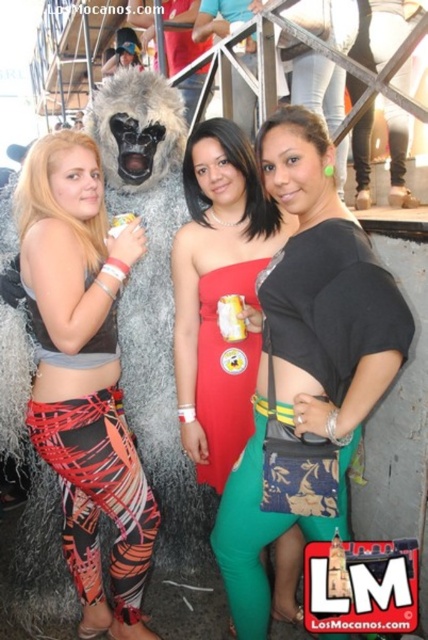
Question: Where is black matte top at center located in relation to red satin dress at center in the image?

Choices:
 (A) left
 (B) right

Answer: (B)

Question: Which of the following is the closest to the observer?

Choices:
 (A) red satin dress at center
 (B) matte red dress at center
 (C) black matte top at center

Answer: (C)

Question: Is matte red dress at center bigger than red satin dress at center?

Choices:
 (A) yes
 (B) no

Answer: (A)

Question: Which of the following is the closest to the observer?

Choices:
 (A) (237, 390)
 (B) (178, 390)
 (C) (296, 481)

Answer: (C)

Question: Is printed leggings at left smaller than matte red dress at center?

Choices:
 (A) no
 (B) yes

Answer: (A)

Question: Which object is positioned closest to the printed leggings at left?

Choices:
 (A) matte red dress at center
 (B) red satin dress at center

Answer: (A)